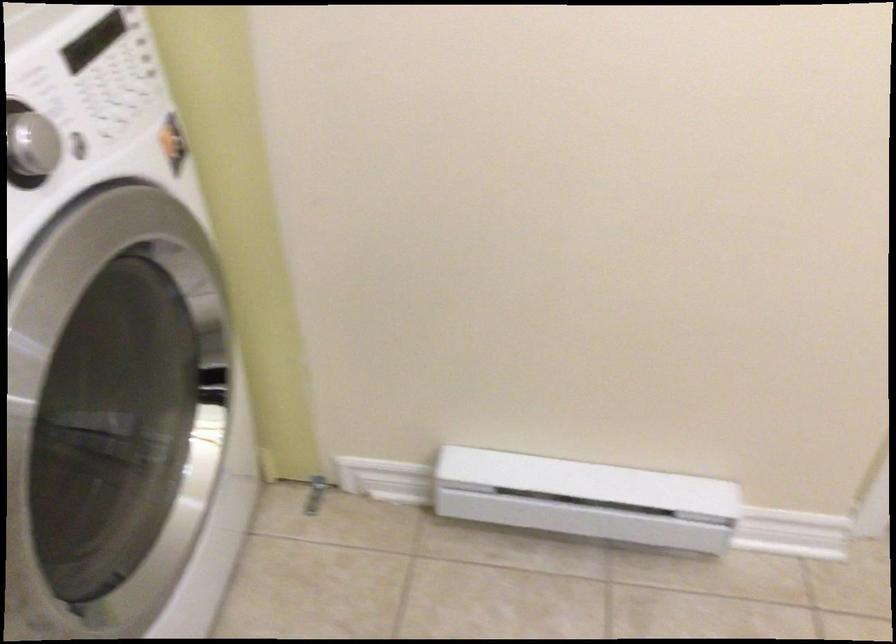
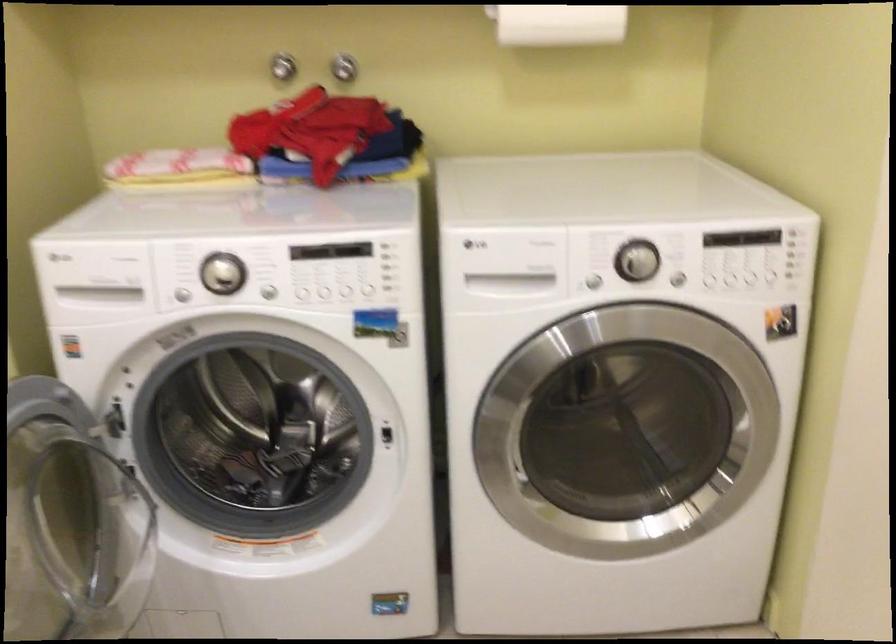
Question: The camera is either moving clockwise (left) or counter-clockwise (right) around the object. The first image is from the beginning of the video and the second image is from the end. Is the camera moving left or right when shooting the video?

Choices:
 (A) Left
 (B) Right

Answer: (B)